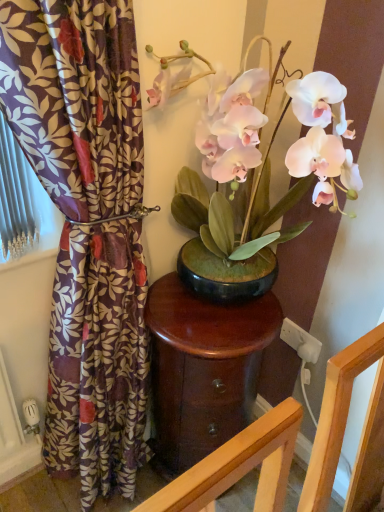
You are a GUI agent. You are given a task and a screenshot of the screen. Output one action in this format:
    pyautogui.click(x=<x>, y=<y>)
    Task: Click on the white matte orchid at center
    Image resolution: width=384 pixels, height=512 pixels.
    Given the screenshot: What is the action you would take?
    pyautogui.click(x=259, y=178)

The height and width of the screenshot is (512, 384). Identify the location of glossy wood table at center. (203, 368).

Describe the element at coordinates (203, 368) in the screenshot. I see `glossy wood table at center` at that location.

Image resolution: width=384 pixels, height=512 pixels. Identify the location of white matte orchid at center. [259, 178].

Is glossy wood table at center positioned behind purple floral fabric at left?

Yes.

From a real-world perspective, who is located lower, glossy wood table at center or purple floral fabric at left?

glossy wood table at center, from a real-world perspective.

Where is `table behind the purple floral fabric at left`? table behind the purple floral fabric at left is located at coordinates (203, 368).

From the image's perspective, is glossy wood table at center positioned above or below white matte orchid at center?

From the image's perspective, glossy wood table at center appears below white matte orchid at center.

Would you say white matte orchid at center is part of glossy wood table at center's contents?

Definitely not — white matte orchid at center is not inside glossy wood table at center.

Based on the photo, considering the positions of objects glossy wood table at center and white matte orchid at center in the image provided, who is behind, glossy wood table at center or white matte orchid at center?

Positioned behind is glossy wood table at center.

Can you tell me how much glossy wood table at center and white matte orchid at center differ in facing direction?

The angle between the facing direction of glossy wood table at center and the facing direction of white matte orchid at center is 1.16 degrees.

Considering the sizes of objects white matte orchid at center and purple floral fabric at left in the image provided, who is shorter, white matte orchid at center or purple floral fabric at left?

Standing shorter between the two is white matte orchid at center.

Which is behind, white matte orchid at center or purple floral fabric at left?

white matte orchid at center is more distant.

Does point (238, 261) lie behind point (87, 206)?

Yes, point (238, 261) is farther from viewer.

Considering the positions of objects white matte orchid at center and purple floral fabric at left in the image provided, who is more to the right, white matte orchid at center or purple floral fabric at left?

white matte orchid at center.

Does point (90, 160) come in front of point (177, 218)?

Yes, point (90, 160) is closer to viewer.

Is white matte orchid at center inside purple floral fabric at left?

No, purple floral fabric at left does not contain white matte orchid at center.

Where is `houseplant behind the purple floral fabric at left`? This screenshot has height=512, width=384. houseplant behind the purple floral fabric at left is located at coordinates (259, 178).

Is purple floral fabric at left turned away from white matte orchid at center?

No, white matte orchid at center is not at the back of purple floral fabric at left.

Is purple floral fabric at left oriented away from glossy wood table at center?

Result: That's not correct — purple floral fabric at left is not looking away from glossy wood table at center.

Between purple floral fabric at left and glossy wood table at center, which one has larger size?

purple floral fabric at left is bigger.

In the scene shown: Which object is positioned more to the left, purple floral fabric at left or glossy wood table at center?

purple floral fabric at left.

From a real-world perspective, relative to glossy wood table at center, is white matte orchid at center vertically above or below?

white matte orchid at center is situated higher than glossy wood table at center in the real world.

What's the angular difference between white matte orchid at center and glossy wood table at center's facing directions?

1.16 degrees separate the facing orientations of white matte orchid at center and glossy wood table at center.

Is white matte orchid at center inside or outside of glossy wood table at center?

white matte orchid at center exists outside the volume of glossy wood table at center.

Which object is positioned more to the right, white matte orchid at center or glossy wood table at center?

Positioned to the right is white matte orchid at center.

Find the location of a particular element. This screenshot has width=384, height=512. curtain above the glossy wood table at center (from a real-world perspective) is located at coordinates (86, 226).

Where is `houseplant above the glossy wood table at center (from the image's perspective)`? This screenshot has width=384, height=512. houseplant above the glossy wood table at center (from the image's perspective) is located at coordinates (259, 178).

Based on their spatial positions, is glossy wood table at center or purple floral fabric at left closer to white matte orchid at center?

Among the two, glossy wood table at center is located nearer to white matte orchid at center.

Based on their spatial positions, is glossy wood table at center or white matte orchid at center closer to purple floral fabric at left?

glossy wood table at center.

Which object lies further to the anchor point white matte orchid at center, purple floral fabric at left or glossy wood table at center?

purple floral fabric at left lies further to white matte orchid at center than the other object.

Which object lies nearer to the anchor point glossy wood table at center, white matte orchid at center or purple floral fabric at left?

purple floral fabric at left is positioned closer to the anchor glossy wood table at center.

Looking at the image, which one is located further to purple floral fabric at left, white matte orchid at center or glossy wood table at center?

Based on the image, white matte orchid at center appears to be further to purple floral fabric at left.

Which object lies nearer to the anchor point glossy wood table at center, purple floral fabric at left or white matte orchid at center?

The object closer to glossy wood table at center is purple floral fabric at left.

Where is `curtain between white matte orchid at center and glossy wood table at center in the vertical direction`? The width and height of the screenshot is (384, 512). curtain between white matte orchid at center and glossy wood table at center in the vertical direction is located at coordinates (86, 226).